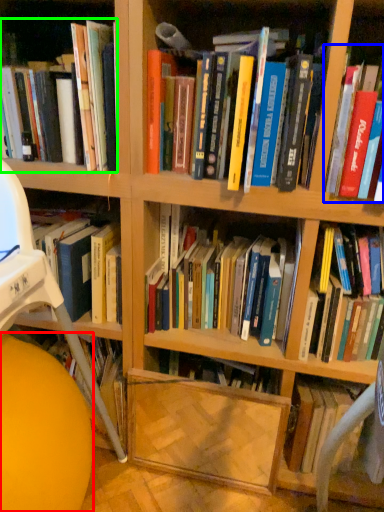
Question: Based on their relative distances, which object is farther from ball (highlighted by a red box)? Choose from book (highlighted by a blue box) and book (highlighted by a green box).

Choices:
 (A) book
 (B) book

Answer: (A)